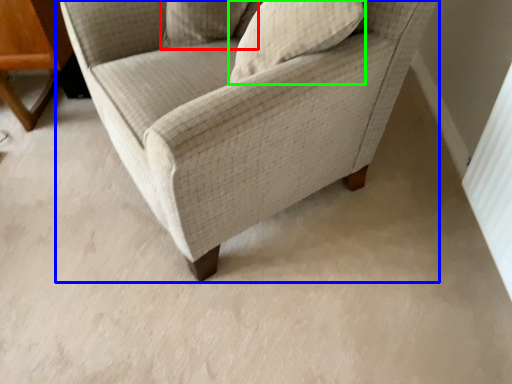
Question: Based on their relative distances, which object is nearer to pillow (highlighted by a red box)? Choose from chair (highlighted by a blue box) and pillow (highlighted by a green box).

Choices:
 (A) chair
 (B) pillow

Answer: (B)